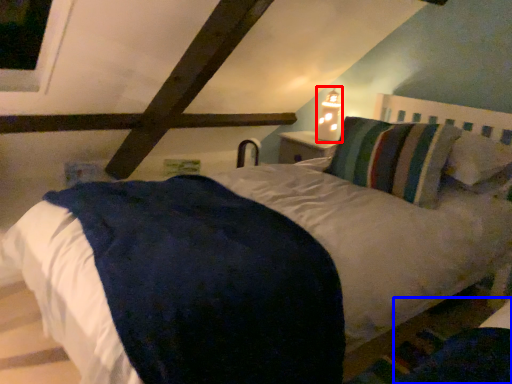
Question: Which object appears farthest to the camera in this image, bedside lamp (highlighted by a red box) or dark (highlighted by a blue box)?

Choices:
 (A) bedside lamp
 (B) dark

Answer: (A)